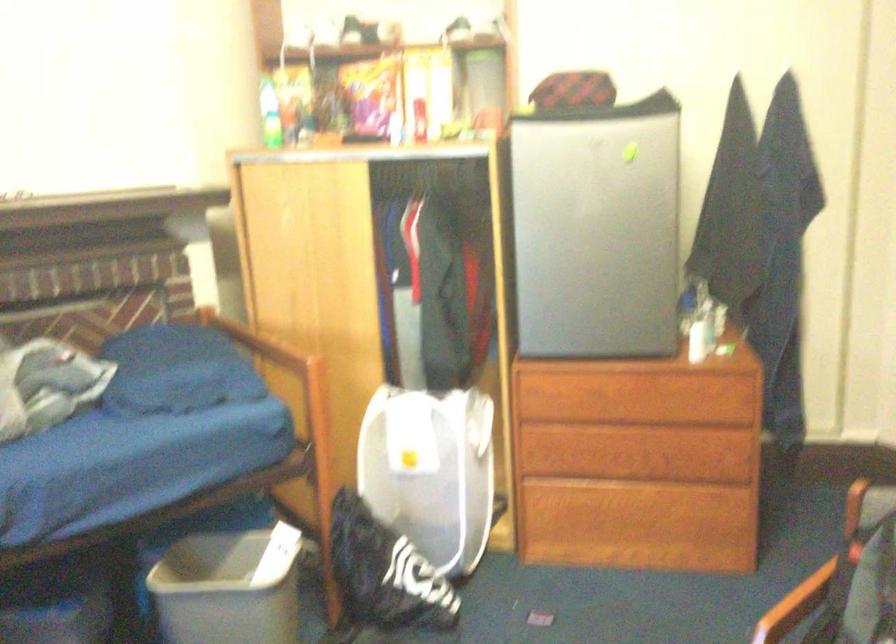
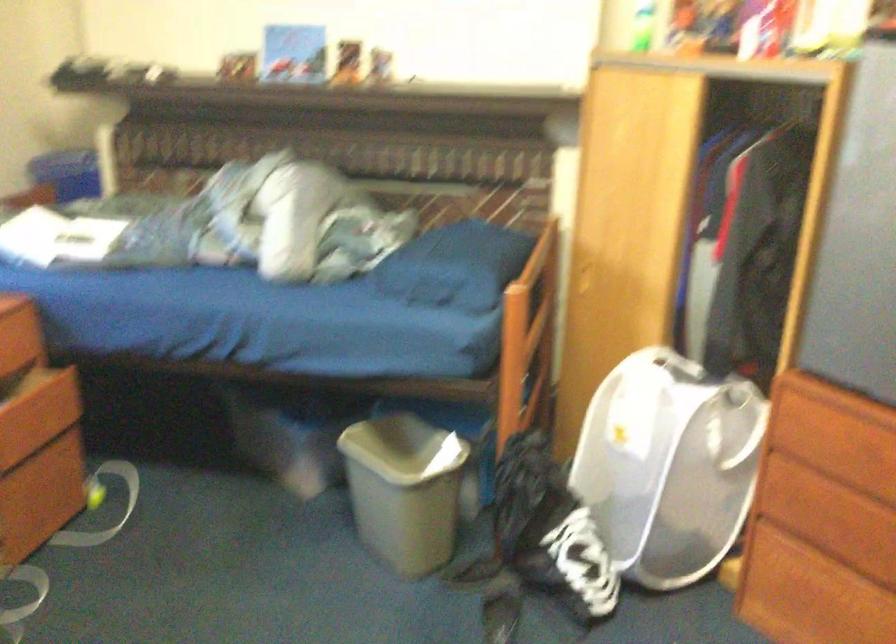
Where in the second image is the point corresponding to point 289,257 from the first image?

(613, 182)